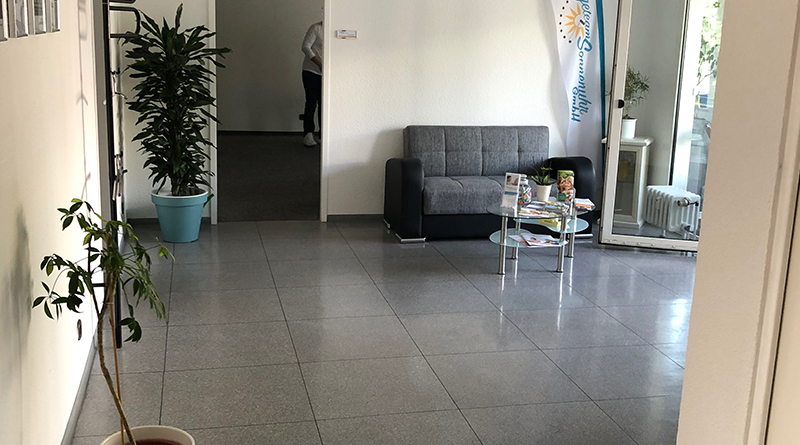
At what (x,y) coordinates should I click in order to perform the action: click on empty space on floor. Please return your answer as a coordinate pair (x, y). Looking at the image, I should click on (258, 182), (290, 310), (474, 394).